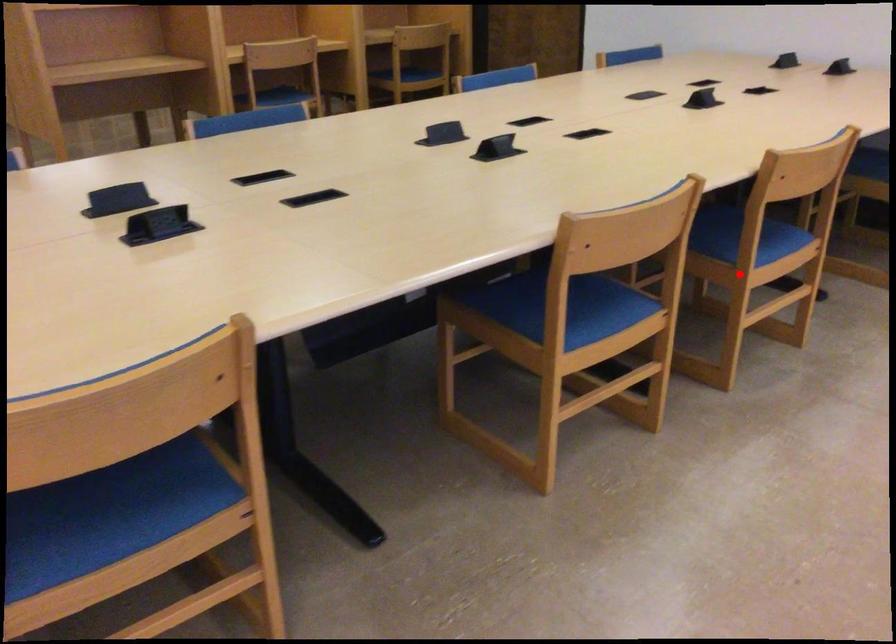
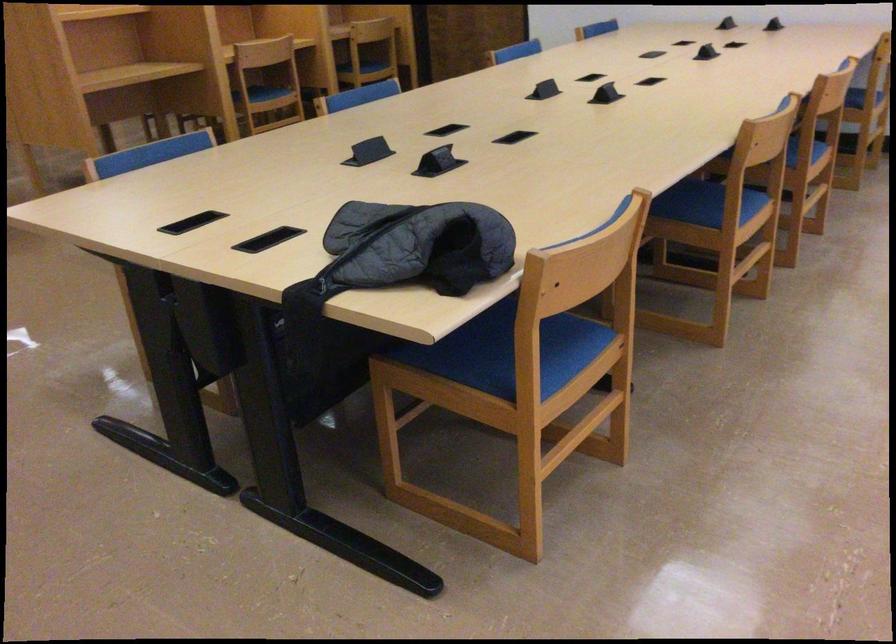
Find the pixel in the second image that matches the highlighted location in the first image.

(805, 171)